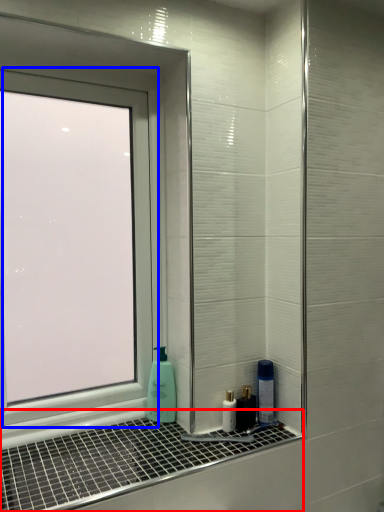
Question: Which point is further to the camera, window sill (highlighted by a red box) or window (highlighted by a blue box)?

Choices:
 (A) window sill
 (B) window

Answer: (B)